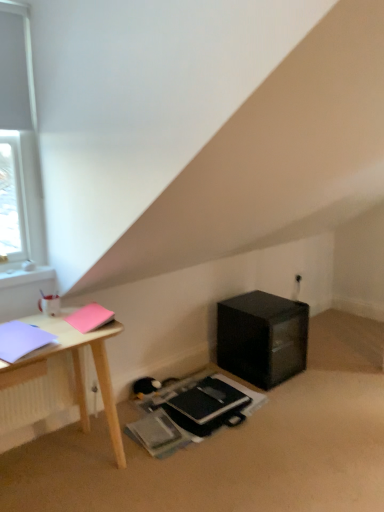
What do you see at coordinates (19, 142) in the screenshot?
I see `white matte window at upper left` at bounding box center [19, 142].

Measure the distance between pink matte notebook at upper left, the 2th notebook positioned from the back, and camera.

6.12 feet.

Measure the distance between matte purple notebook at left, which ranks as the 1th notebook in front-to-back order, and camera.

The distance of matte purple notebook at left, which ranks as the 1th notebook in front-to-back order, from camera is 1.59 meters.

Describe the element at coordinates (262, 337) in the screenshot. This screenshot has width=384, height=512. I see `black plastic at lower right` at that location.

At what (x,y) coordinates should I click in order to perform the action: click on white matte window at upper left. Please return your answer as a coordinate pair (x, y). Looking at the image, I should click on (19, 142).

Is pink matte notebook at upper left, the second notebook viewed from the front, at the back of black matte notebook at lower center, the third notebook viewed from the left?

No.

Is black matte notebook at lower center, the first notebook when ordered from bottom to top, placed right next to pink matte notebook at upper left, the second notebook viewed from the front?

No, black matte notebook at lower center, the first notebook when ordered from bottom to top, is not in contact with pink matte notebook at upper left, the second notebook viewed from the front.

Which is in front, point (225, 392) or point (83, 323)?

The point (83, 323) is closer.

From a real-world perspective, which notebook is the 2nd one above the black matte notebook at lower center, placed as the 1th notebook when sorted from back to front? Please provide its 2D coordinates.

[(90, 318)]

From a real-world perspective, is white matte window at upper left over pink matte notebook at upper left, the second notebook viewed from the front?

Indeed, from a real-world perspective, white matte window at upper left stands above pink matte notebook at upper left, the second notebook viewed from the front.

Would you say white matte window at upper left is inside or outside pink matte notebook at upper left, positioned as the second notebook in right-to-left order?

white matte window at upper left cannot be found inside pink matte notebook at upper left, positioned as the second notebook in right-to-left order.

How many degrees apart are the facing directions of white matte window at upper left and pink matte notebook at upper left, placed as the first notebook when sorted from top to bottom?

The facing directions of white matte window at upper left and pink matte notebook at upper left, placed as the first notebook when sorted from top to bottom, are 3.11 degrees apart.

Which of these two, white matte window at upper left or pink matte notebook at upper left, the second notebook positioned from the left, is wider?

With larger width is pink matte notebook at upper left, the second notebook positioned from the left.

Considering the relative sizes of white matte window at upper left and matte purple notebook at left, which ranks as the 3th notebook in back-to-front order, in the image provided, is white matte window at upper left taller than matte purple notebook at left, which ranks as the 3th notebook in back-to-front order,?

Yes, white matte window at upper left is taller than matte purple notebook at left, which ranks as the 3th notebook in back-to-front order.

What are the coordinates of `window above the matte purple notebook at left, the 3th notebook from the right (from the image's perspective)` in the screenshot? It's located at (19, 142).

From the image's perspective, which one is positioned lower, white matte window at upper left or matte purple notebook at left, marked as the 1th notebook in a left-to-right arrangement?

matte purple notebook at left, marked as the 1th notebook in a left-to-right arrangement, appears lower in the image.

Considering the relative positions of white matte window at upper left and matte purple notebook at left, which ranks as the 1th notebook in front-to-back order, in the image provided, is white matte window at upper left to the right of matte purple notebook at left, which ranks as the 1th notebook in front-to-back order, from the viewer's perspective?

Incorrect, white matte window at upper left is not on the right side of matte purple notebook at left, which ranks as the 1th notebook in front-to-back order.

From the image's perspective, does matte purple notebook at left, the second notebook from the top, appear higher than black plastic at lower right?

Indeed, from the image's perspective, matte purple notebook at left, the second notebook from the top, is shown above black plastic at lower right.

Can you confirm if matte purple notebook at left, marked as the 1th notebook in a left-to-right arrangement, is shorter than black plastic at lower right?

Indeed, matte purple notebook at left, marked as the 1th notebook in a left-to-right arrangement, has a lesser height compared to black plastic at lower right.

Is point (15, 342) in front of point (279, 303)?

That is True.

Can you tell me how much matte purple notebook at left, marked as the 1th notebook in a left-to-right arrangement, and black plastic at lower right differ in facing direction?

There is a 12.6-degree angle between the facing directions of matte purple notebook at left, marked as the 1th notebook in a left-to-right arrangement, and black plastic at lower right.

Considering the relative positions of white matte window at upper left and black plastic at lower right in the image provided, is white matte window at upper left to the left of black plastic at lower right from the viewer's perspective?

Yes.

Is there a large distance between white matte window at upper left and black plastic at lower right?

white matte window at upper left is positioned a significant distance from black plastic at lower right.

Which object is closer to the camera taking this photo, white matte window at upper left or black plastic at lower right?

white matte window at upper left is closer to the camera.

Considering the sizes of objects pink matte notebook at upper left, the 2th notebook positioned from the back, and black plastic at lower right in the image provided, who is bigger, pink matte notebook at upper left, the 2th notebook positioned from the back, or black plastic at lower right?

With larger size is black plastic at lower right.

From the picture: In terms of width, does pink matte notebook at upper left, positioned as the second notebook in right-to-left order, look wider or thinner when compared to black plastic at lower right?

Clearly, pink matte notebook at upper left, positioned as the second notebook in right-to-left order, has less width compared to black plastic at lower right.

Which is farther, (91,307) or (223,349)?

The point (223,349) is more distant.

Measure the distance between black matte notebook at lower center, which is counted as the 1th notebook, starting from the right, and black plastic at lower right.

black matte notebook at lower center, which is counted as the 1th notebook, starting from the right, is 43.15 centimeters away from black plastic at lower right.

Is point (224, 414) behind point (284, 316)?

No, it is not.

Could you tell me if black matte notebook at lower center, the third notebook viewed from the left, is turned towards black plastic at lower right?

No, black matte notebook at lower center, the third notebook viewed from the left, is not oriented towards black plastic at lower right.

What's the angular difference between black matte notebook at lower center, the first notebook when ordered from bottom to top, and black plastic at lower right's facing directions?

0.321 degrees.

I want to click on the 2nd notebook below the pink matte notebook at upper left, the second notebook positioned from the left (from the image's perspective), so click(208, 401).

At what (x,y) coordinates should I click in order to perform the action: click on window on the left of pink matte notebook at upper left, placed as the first notebook when sorted from top to bottom. Please return your answer as a coordinate pair (x, y). The image size is (384, 512). Looking at the image, I should click on (19, 142).

Based on their spatial positions, is black plastic at lower right or pink matte notebook at upper left, the second notebook viewed from the front, further from black matte notebook at lower center, which is the third notebook in top-to-bottom order?

pink matte notebook at upper left, the second notebook viewed from the front, lies further to black matte notebook at lower center, which is the third notebook in top-to-bottom order, than the other object.

From the image, which object appears to be nearer to black matte notebook at lower center, the first notebook when ordered from bottom to top, matte purple notebook at left, marked as the 1th notebook in a left-to-right arrangement, or white matte window at upper left?

matte purple notebook at left, marked as the 1th notebook in a left-to-right arrangement, is closer to black matte notebook at lower center, the first notebook when ordered from bottom to top.

When comparing their distances from white matte window at upper left, does black plastic at lower right or black matte notebook at lower center, placed as the 1th notebook when sorted from back to front, seem closer?

black matte notebook at lower center, placed as the 1th notebook when sorted from back to front, lies closer to white matte window at upper left than the other object.

Looking at the image, which one is located closer to black plastic at lower right, white matte window at upper left or pink matte notebook at upper left, which is the 3th notebook from bottom to top?

The object closer to black plastic at lower right is pink matte notebook at upper left, which is the 3th notebook from bottom to top.

When comparing their distances from black plastic at lower right, does matte purple notebook at left, the second notebook from the top, or black matte notebook at lower center, which is counted as the 1th notebook, starting from the right, seem further?

matte purple notebook at left, the second notebook from the top, lies further to black plastic at lower right than the other object.

Estimate the real-world distances between objects in this image. Which object is closer to black plastic at lower right, white matte window at upper left or black matte notebook at lower center, the third notebook viewed from the left?

The object closer to black plastic at lower right is black matte notebook at lower center, the third notebook viewed from the left.

Looking at the image, which one is located further to black plastic at lower right, pink matte notebook at upper left, positioned as the second notebook in right-to-left order, or white matte window at upper left?

white matte window at upper left is positioned further to the anchor black plastic at lower right.

From the image, which object appears to be nearer to black plastic at lower right, pink matte notebook at upper left, which is the 3th notebook from bottom to top, or black matte notebook at lower center, the first notebook when ordered from bottom to top?

black matte notebook at lower center, the first notebook when ordered from bottom to top.

The height and width of the screenshot is (512, 384). Identify the location of notebook between matte purple notebook at left, the 3th notebook from the right, and black matte notebook at lower center, which is the third notebook in top-to-bottom order, in the horizontal direction. (90, 318).

Where is `notebook located between pink matte notebook at upper left, the second notebook viewed from the front, and black plastic at lower right in the left-right direction`? notebook located between pink matte notebook at upper left, the second notebook viewed from the front, and black plastic at lower right in the left-right direction is located at coordinates (208, 401).

You are a GUI agent. You are given a task and a screenshot of the screen. Output one action in this format:
    pyautogui.click(x=<x>, y=<y>)
    Task: Click on the notebook between white matte window at upper left and matte purple notebook at left, marked as the 1th notebook in a left-to-right arrangement, vertically
    The image size is (384, 512).
    Given the screenshot: What is the action you would take?
    pyautogui.click(x=90, y=318)

Locate an element on the screen. nightstand between white matte window at upper left and black matte notebook at lower center, which is the third notebook in top-to-bottom order, from top to bottom is located at coordinates (262, 337).